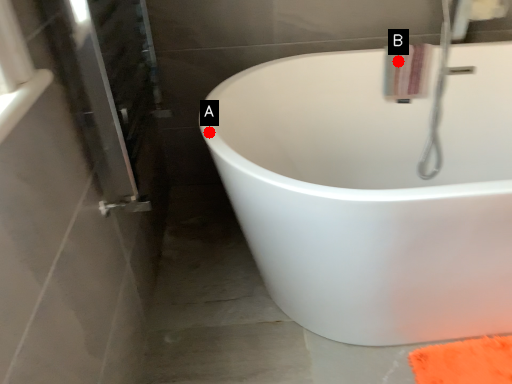
Question: Two points are circled on the image, labeled by A and B beside each circle. Which of the following is the closest to the observer?

Choices:
 (A) A is closer
 (B) B is closer

Answer: (A)